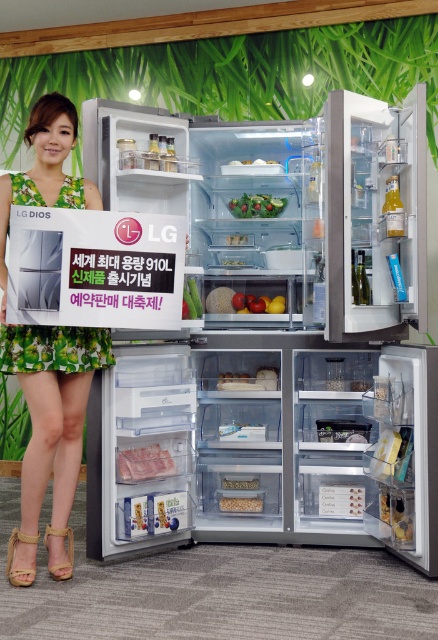
Question: Where is sleek stainless steel refrigerator at center located in relation to green floral dress at left in the image?

Choices:
 (A) above
 (B) below

Answer: (A)

Question: Observing the image, what is the correct spatial positioning of sleek stainless steel refrigerator at center in reference to white matte rice at center?

Choices:
 (A) right
 (B) left

Answer: (A)

Question: Is the position of green leafy salad at center less distant than that of white matte rice at center?

Choices:
 (A) no
 (B) yes

Answer: (A)

Question: Which point is closer to the camera?

Choices:
 (A) green floral dress at left
 (B) sleek stainless steel refrigerator at center
 (C) green leafy salad at center
 (D) white matte rice at center

Answer: (A)

Question: Which point is farther from the camera taking this photo?

Choices:
 (A) (230, 509)
 (B) (246, 193)
 (C) (352, 250)
 (D) (6, 234)

Answer: (B)

Question: Which object is positioned farthest from the white matte rice at center?

Choices:
 (A) green leafy salad at center
 (B) green floral dress at left

Answer: (A)